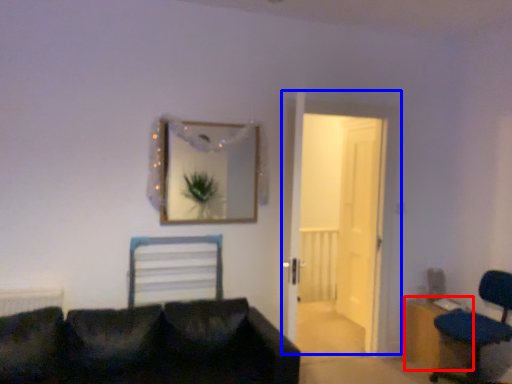
Question: Which object appears closest to the camera in this image, dresser (highlighted by a red box) or door (highlighted by a blue box)?

Choices:
 (A) dresser
 (B) door

Answer: (B)